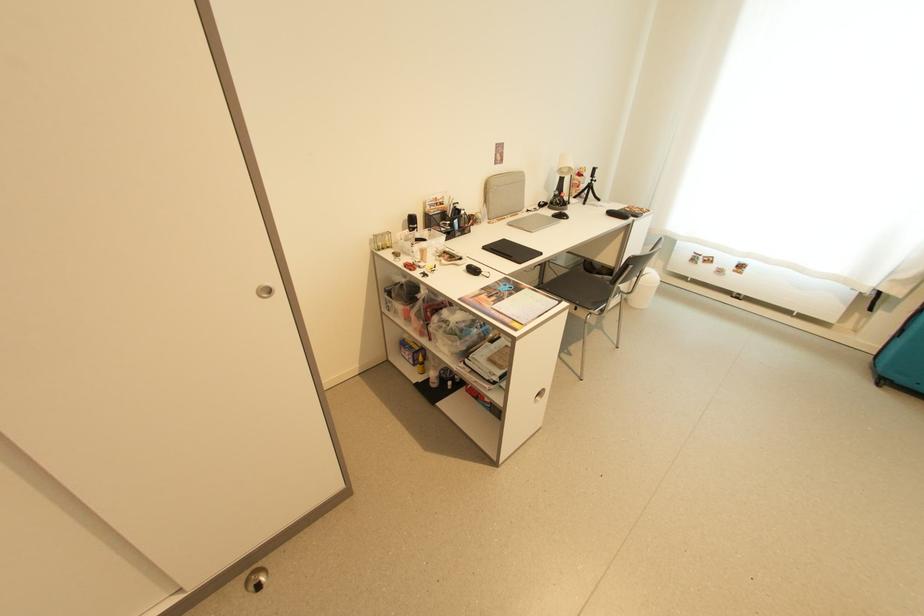
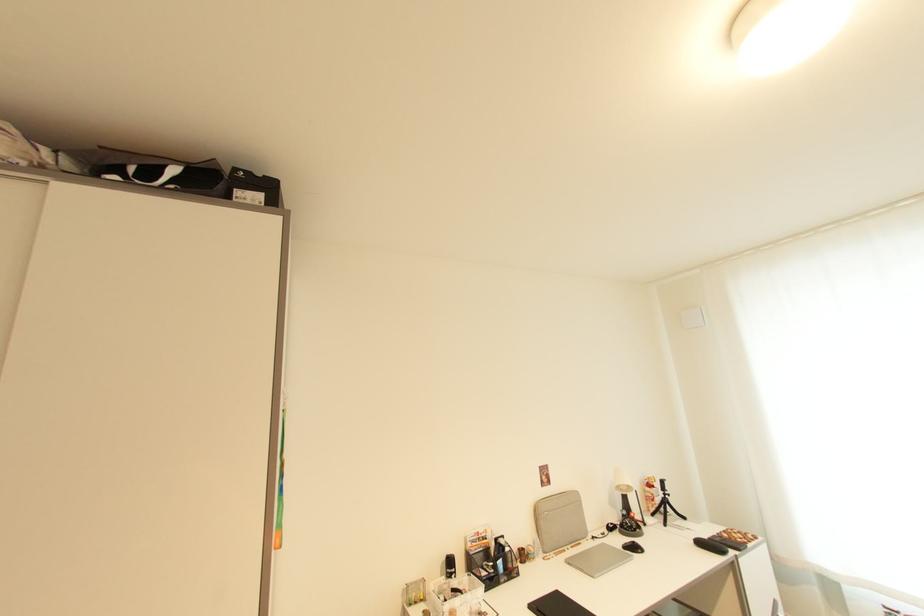
The point at (508, 241) is marked in the first image. Where is the corresponding point in the second image?

(562, 594)